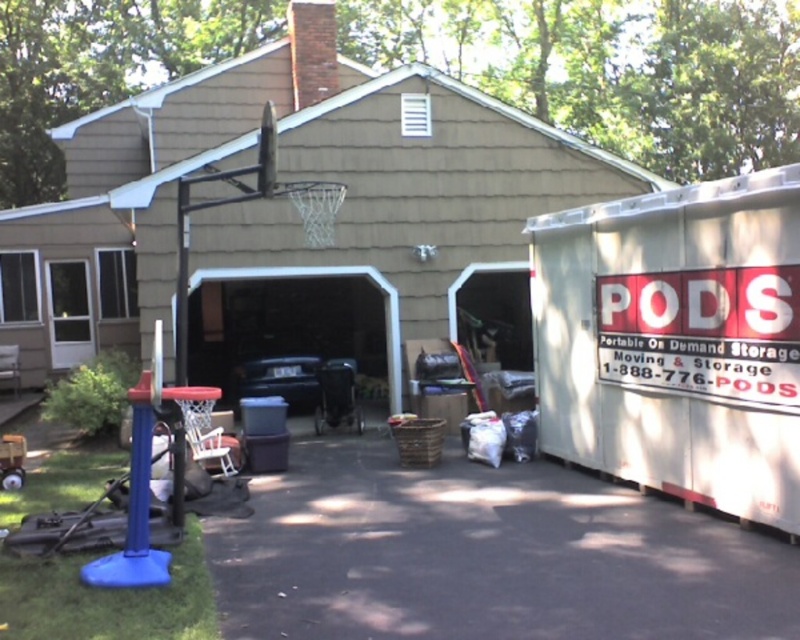
You are standing in the garage and need to move a box from the stroller to the PODS container. The stroller is located at point (x=244, y=257) and the PODS container is at point (x=314, y=266). Which point is closer to you if you are facing the garage door?

Point (x=244, y=257) is in front of point (x=314, y=266), so if you are facing the garage door, the stroller at point (x=244, y=257) is closer to you.

You are trying to park your car in the garage. There is a white plastic storage container at right and a matte black carport at center. Which object is closer to the garage door so that you can drive around it easily?

The white plastic storage container at right is positioned on the right side of matte black carport at center, so the matte black carport at center is closer to the garage door. You can drive around the white plastic storage container at right more easily since it is further away from the garage door.

You are trying to park your car in the garage. You see the black asphalt driveway at lower center and the matte black carport at center. Which one is the correct path to follow to park under the carport?

The black asphalt driveway at lower center is positioned under the matte black carport at center, so following the black asphalt driveway at lower center will lead you to park under the carport.